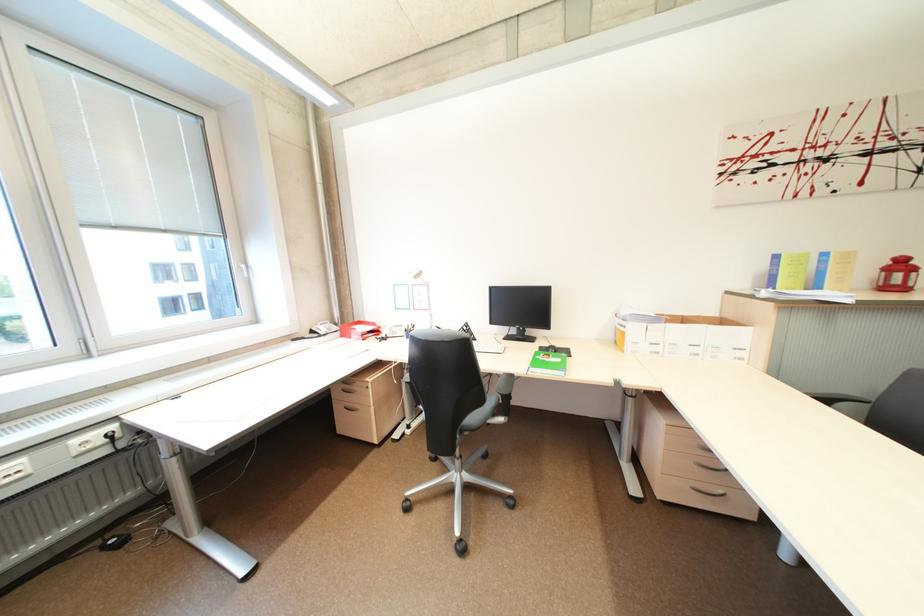
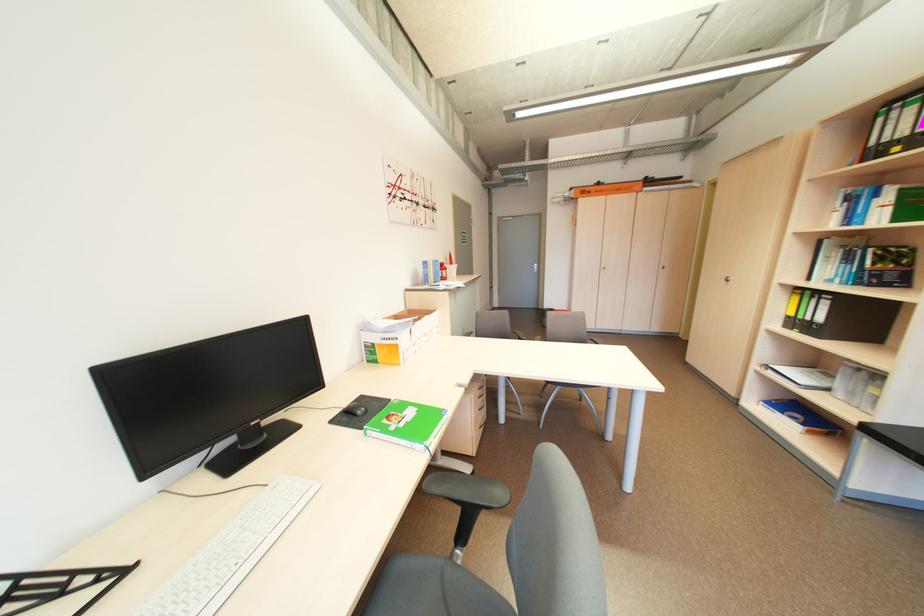
The point at (633, 334) is marked in the first image. Where is the corresponding point in the second image?

(406, 347)